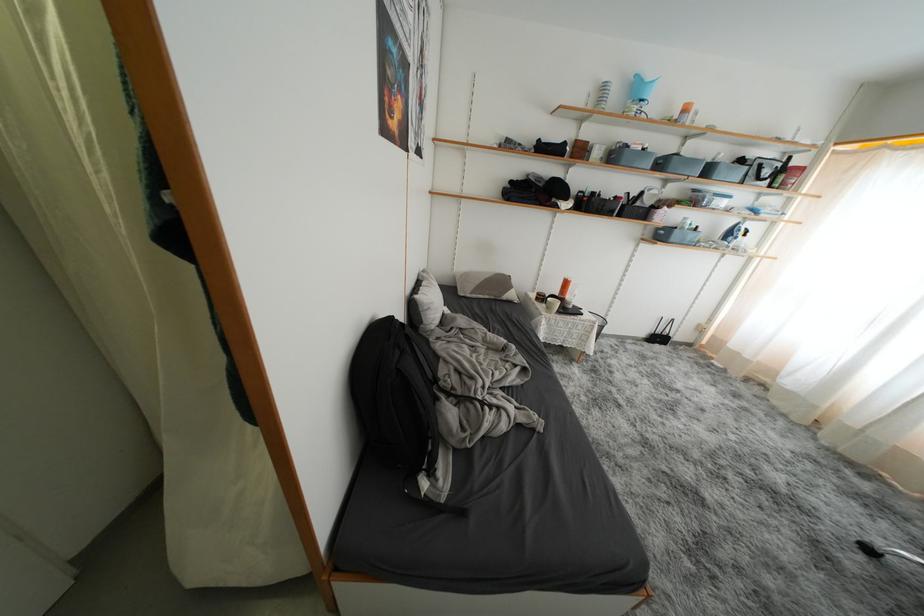
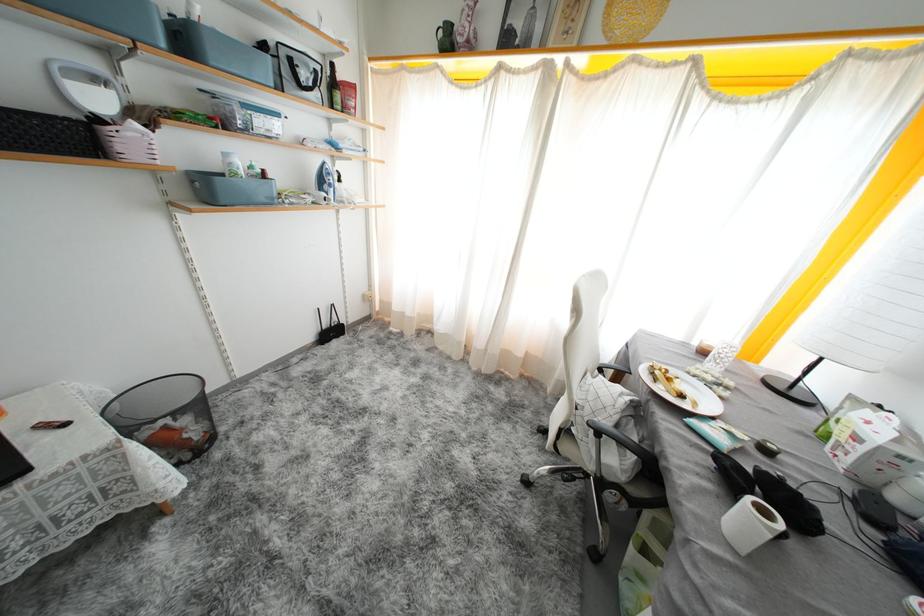
In the second image, find the point that corresponds to pixel 672 212 in the first image.

(141, 129)